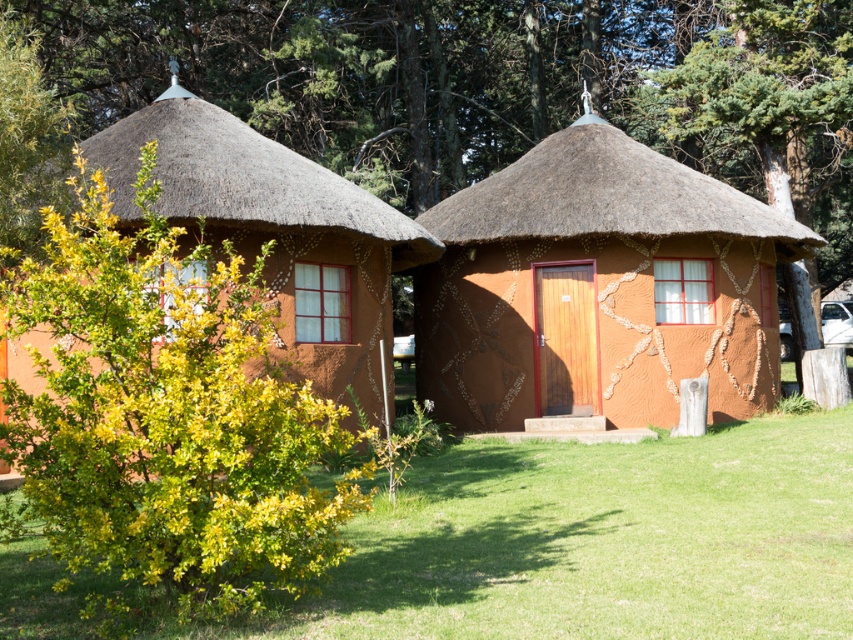
Question: Does green leafy bush at center have a smaller size compared to green grass at lower center?

Choices:
 (A) no
 (B) yes

Answer: (A)

Question: Which of the following is the closest to the observer?

Choices:
 (A) green leafy bush at center
 (B) green textured tree at center

Answer: (A)

Question: Can you confirm if matte clay hut at center is positioned above thatched straw roof at upper left?

Choices:
 (A) no
 (B) yes

Answer: (A)

Question: Among these objects, which one is farthest from the camera?

Choices:
 (A) green leafy bush at center
 (B) brown thatch roof at center

Answer: (B)

Question: Which of these objects is positioned farthest from the brown thatch roof at center?

Choices:
 (A) green leafy bush at center
 (B) thatched straw roof at upper left

Answer: (A)

Question: Can you confirm if matte clay hut at center is positioned to the right of matte clay hut at left?

Choices:
 (A) no
 (B) yes

Answer: (B)